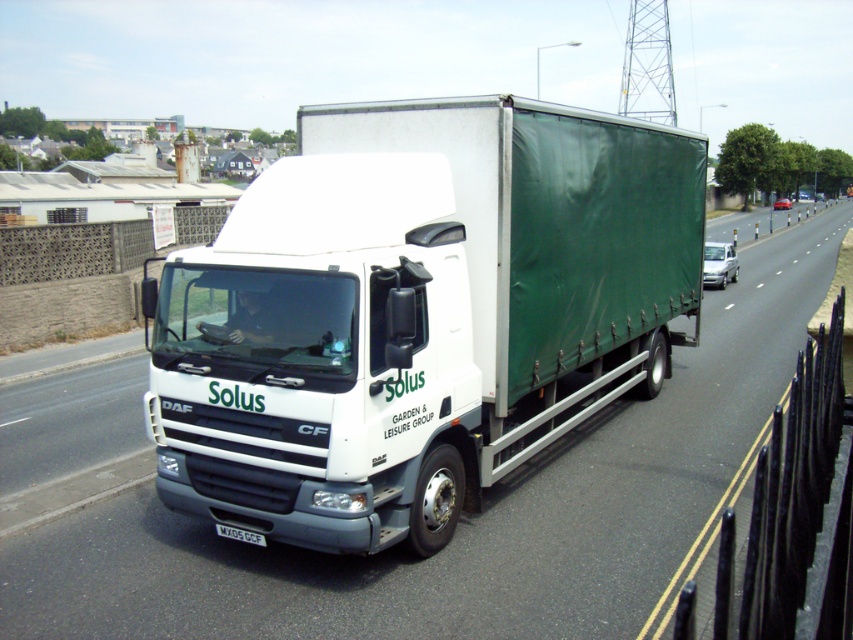
Question: Which object is positioned closest to the white truck at center?

Choices:
 (A) white plastic license plate at center
 (B) white matte truck at center

Answer: (A)

Question: In this image, where is white matte truck at center located relative to white plastic license plate at center?

Choices:
 (A) left
 (B) right

Answer: (B)

Question: Among these points, which one is nearest to the camera?

Choices:
 (A) (492, 593)
 (B) (224, 524)
 (C) (665, 340)

Answer: (A)

Question: Which object appears closest to the camera in this image?

Choices:
 (A) white matte truck at center
 (B) white truck at center

Answer: (B)

Question: Can you confirm if white truck at center is wider than white plastic license plate at center?

Choices:
 (A) yes
 (B) no

Answer: (A)

Question: Is white truck at center thinner than white plastic license plate at center?

Choices:
 (A) yes
 (B) no

Answer: (B)